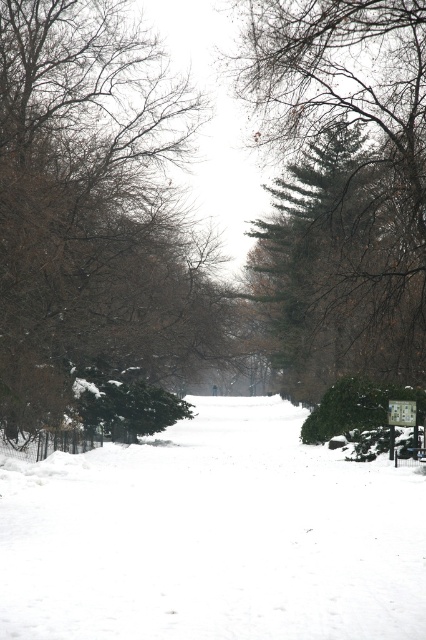
Question: Is brown/dry wood tree at center bigger than metallic silver sign at center?

Choices:
 (A) no
 (B) yes

Answer: (B)

Question: Which object appears closest to the camera in this image?

Choices:
 (A) metallic silver sign at center
 (B) green textured pine tree at center

Answer: (B)

Question: Does white powdery snow at center have a larger size compared to green textured pine tree at center?

Choices:
 (A) no
 (B) yes

Answer: (A)

Question: Among these points, which one is nearest to the camera?

Choices:
 (A) (419, 4)
 (B) (40, 0)
 (C) (391, 433)
 (D) (17, 513)

Answer: (D)

Question: Which is farther from the green textured pine tree at center?

Choices:
 (A) brown/dry wood tree at center
 (B) white powdery snow at center
 (C) metallic silver sign at center

Answer: (C)

Question: Observing the image, what is the correct spatial positioning of white powdery snow at center in reference to brown/dry wood tree at center?

Choices:
 (A) right
 (B) left

Answer: (A)